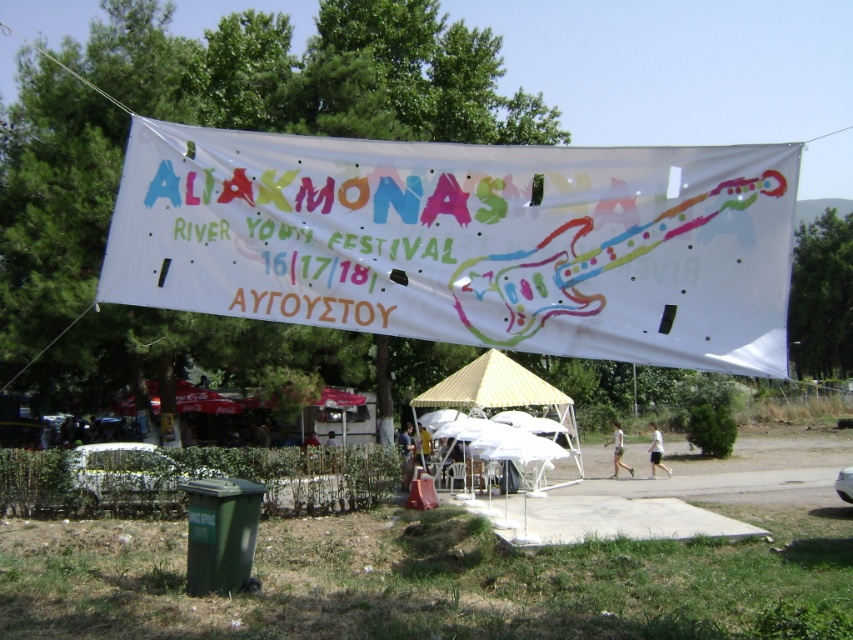
Question: Based on their relative distances, which object is farther from the white fabric canopy at center?

Choices:
 (A) white cotton shirt at center
 (B) white cotton shorts at lower center

Answer: (A)

Question: Which object appears closest to the camera in this image?

Choices:
 (A) white cotton shirt at center
 (B) white fabric canopy at center
 (C) white cotton shorts at lower center

Answer: (B)

Question: Does white fabric canopy at center have a larger size compared to white cotton shorts at lower center?

Choices:
 (A) yes
 (B) no

Answer: (B)

Question: In this image, where is white fabric canopy at center located relative to white cotton shirt at center?

Choices:
 (A) right
 (B) left

Answer: (B)

Question: Which point appears farthest from the camera in this image?

Choices:
 (A) (653, 461)
 (B) (577, 289)
 (C) (618, 420)

Answer: (C)

Question: Can you confirm if white fabric canopy at center is positioned to the right of white cotton shirt at center?

Choices:
 (A) no
 (B) yes

Answer: (A)